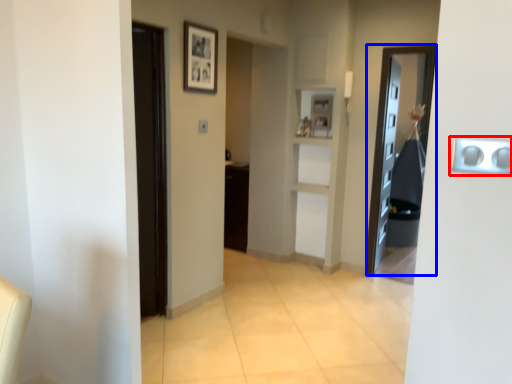
Question: Which point is further to the camera, door handle (highlighted by a red box) or door (highlighted by a blue box)?

Choices:
 (A) door handle
 (B) door

Answer: (B)